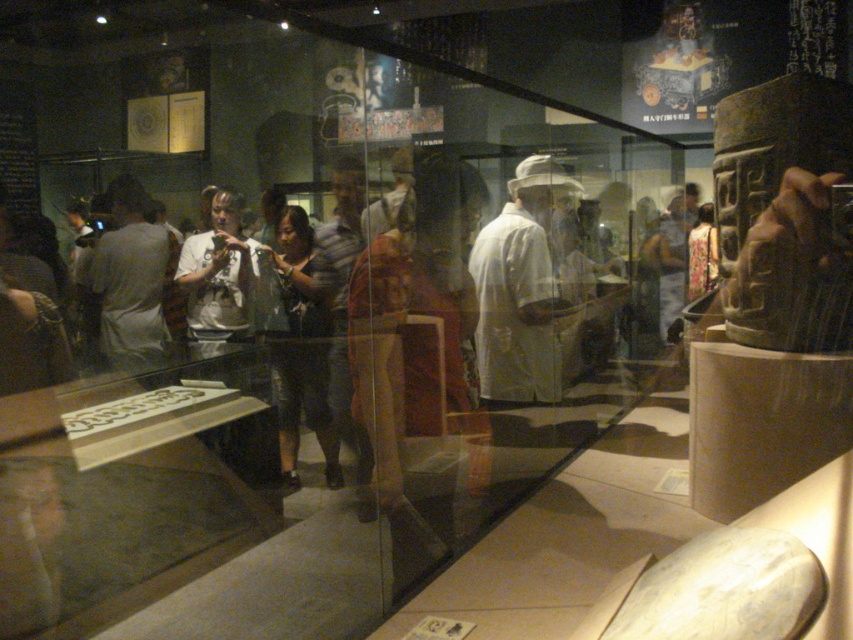
You are a visitor in the museum and want to take a photo of the light gray shirt at left without the dark gray fabric shirt at center blocking the view. Is it possible to do so by moving to the side?

The dark gray fabric shirt at center is closer to the viewer than the light gray shirt at left. Moving to the side might allow you to position yourself so the dark gray fabric shirt at center no longer blocks the view of the light gray shirt at left, as they are at different depths in the scene.

You are a tour guide leading a group in the museum. You notice two visitors wearing the white matte shirt at center and the dark gray fabric shirt at center. You need to ensure they maintain a 1.5 meters social distancing guideline. Are they currently following the guideline?

The distance between the white matte shirt at center and the dark gray fabric shirt at center is 1.27 meters, which is less than the required 1.5 meters. Therefore, they are not maintaining the social distancing guideline and should move further apart.